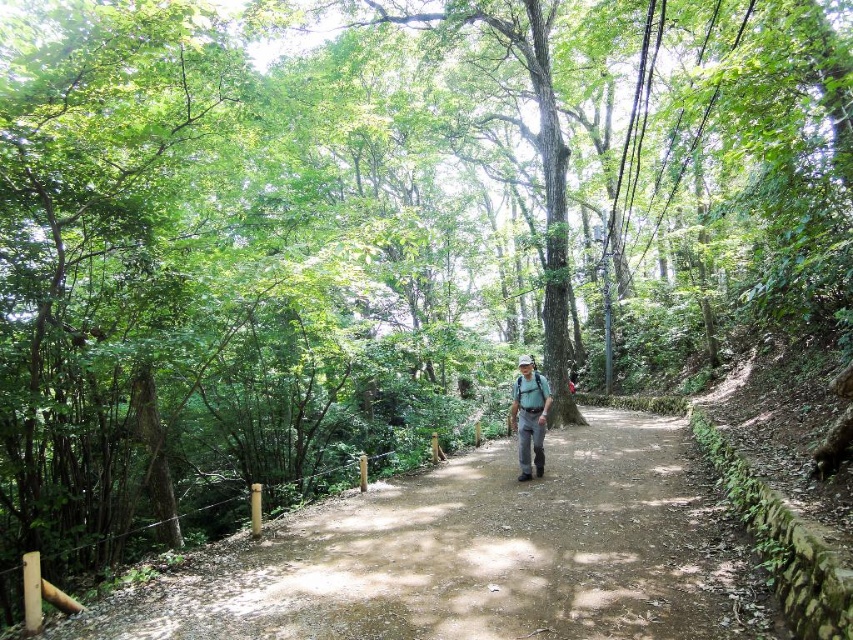
Does dirt path at center have a smaller size compared to camouflage fabric backpack at center?

Actually, dirt path at center might be larger than camouflage fabric backpack at center.

Does point (611, 493) come closer to viewer compared to point (543, 426)?

That is True.

Who is more forward, (514, 637) or (509, 422)?

Point (514, 637)

Locate an element on the screen. dirt path at center is located at coordinates (479, 556).